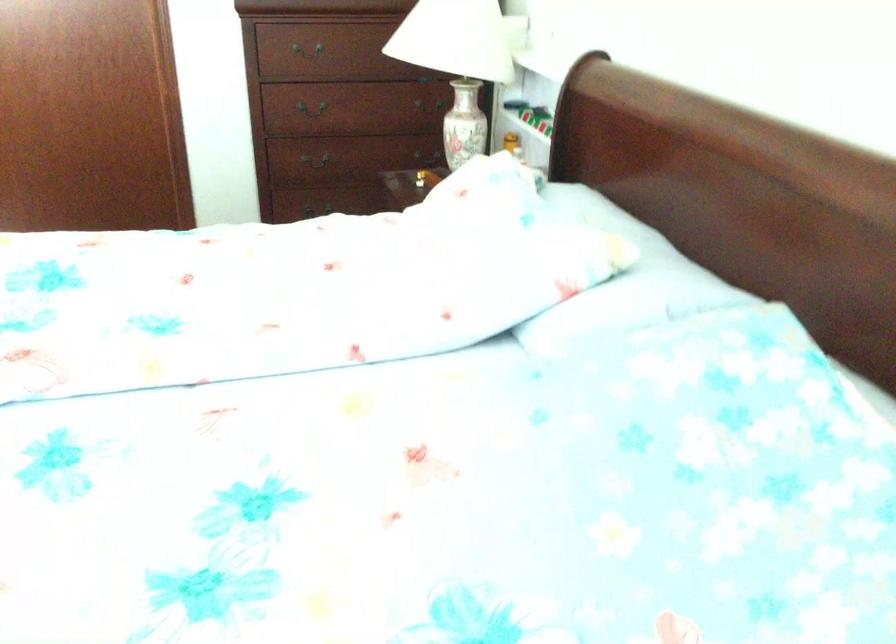
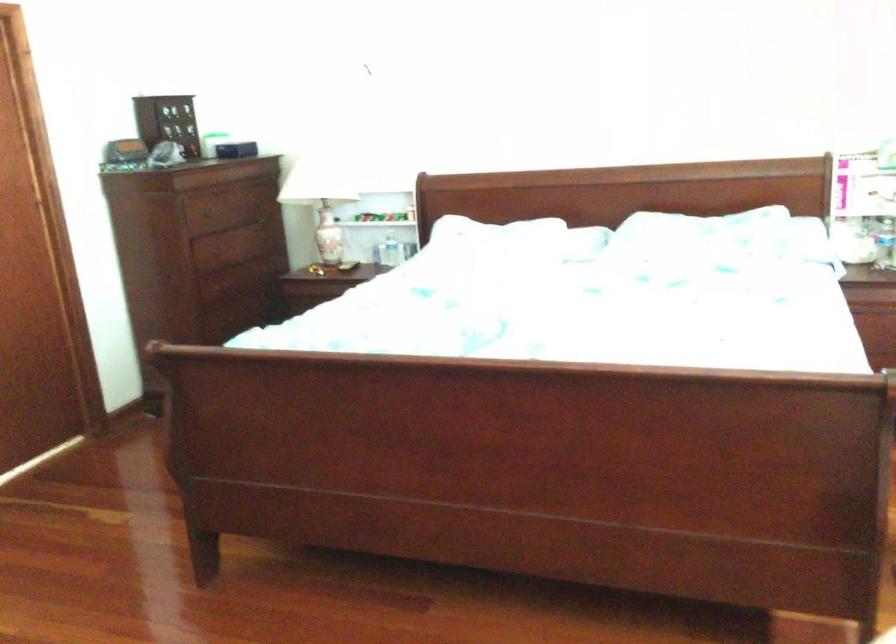
Question: I am providing you with two images of the same scene from different viewpoints. After the viewpoint changes to image2, which objects are now occluded?

Choices:
 (A) plastic water bottle
 (B) towel rack bar
 (C) white floral pillow
 (D) small blue box

Answer: (C)